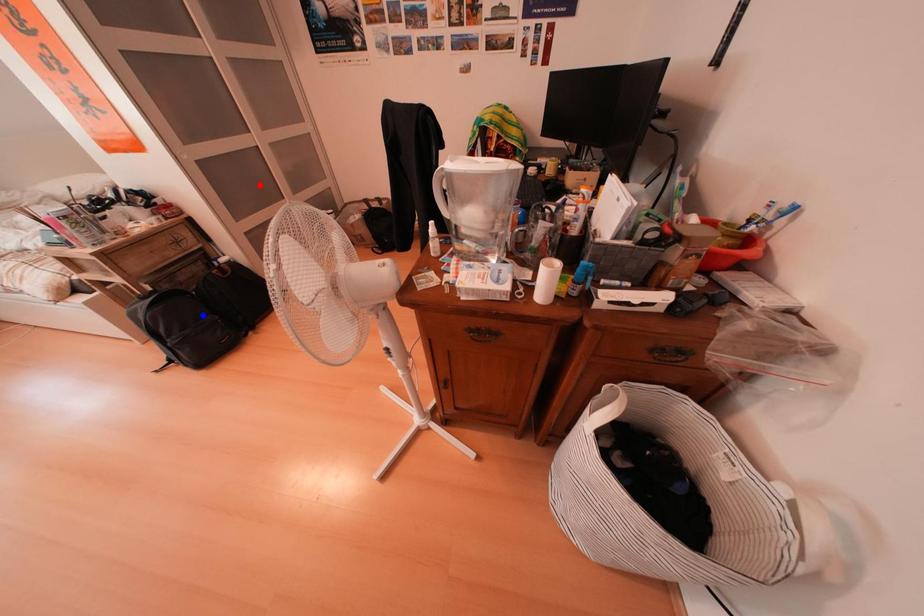
Question: Two points are marked on the image. Which point is closer to the camera?

Choices:
 (A) Blue point is closer.
 (B) Red point is closer.

Answer: (B)